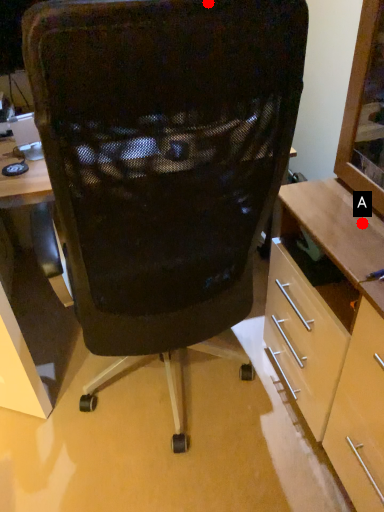
Question: Two points are circled on the image, labeled by A and B beside each circle. Which point appears farthest from the camera in this image?

Choices:
 (A) A is further
 (B) B is further

Answer: (A)